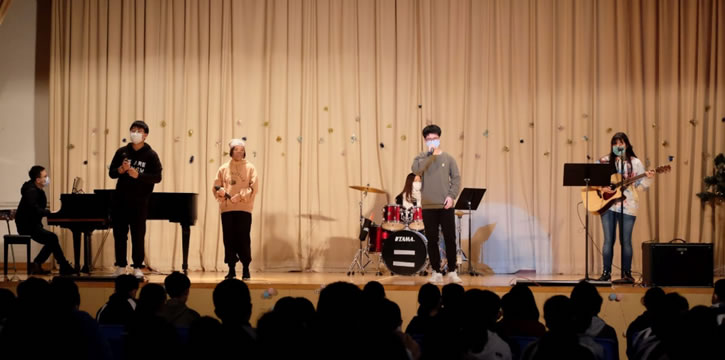
Image resolution: width=725 pixels, height=360 pixels. I want to click on curtain designs, so click(326, 108), click(330, 130), click(320, 140), click(354, 137), click(357, 118), click(381, 145).